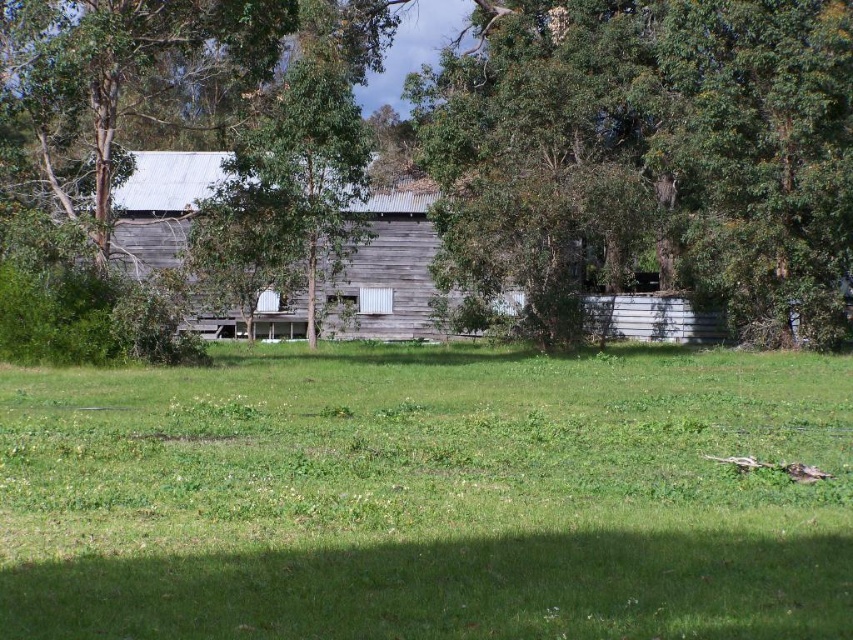
Is green leafy tree at center above weathered wood barn at center?

Indeed, green leafy tree at center is positioned over weathered wood barn at center.

Is point (521, 246) positioned after point (177, 192)?

No.

Identify the location of green leafy tree at center. (653, 147).

Does green grass at center have a lesser width compared to green leafy tree at center?

No, green grass at center is not thinner than green leafy tree at center.

Is green grass at center bigger than green leafy tree at center?

No.

Describe the element at coordinates (427, 496) in the screenshot. I see `green grass at center` at that location.

Locate an element on the screen. This screenshot has width=853, height=640. green grass at center is located at coordinates (427, 496).

Between green grass at center and weathered wood barn at center, which one appears on the right side from the viewer's perspective?

Positioned to the right is green grass at center.

From the picture: Who is taller, green grass at center or weathered wood barn at center?

With more height is weathered wood barn at center.

Who is more forward, [471,500] or [160,172]?

Point [471,500]

Where is `green grass at center`? green grass at center is located at coordinates (427, 496).